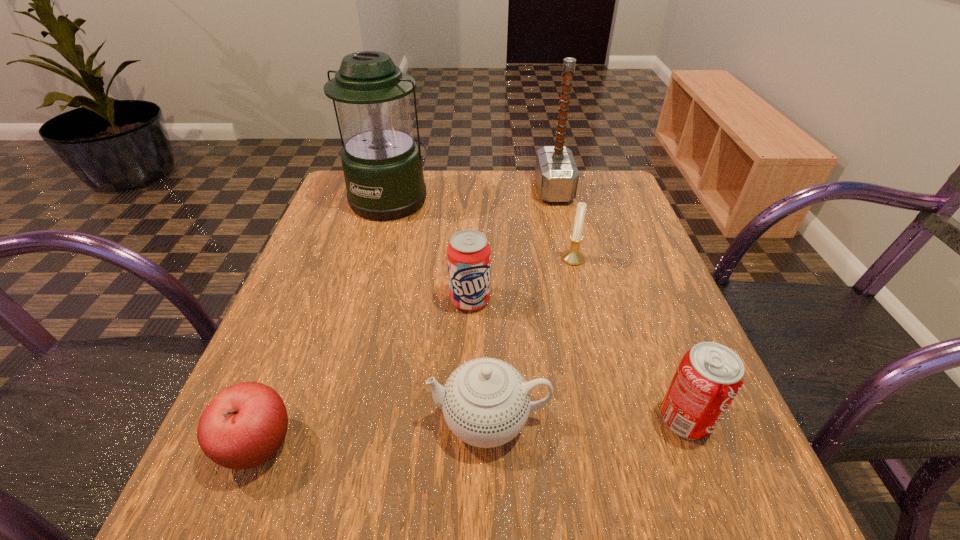
Identify the location of vacant space that satisfies the following two spatial constraints: 1. on the back side of the right soda can; 2. on the striking surface of the hammer. (598, 190).

Find the location of `free space that satisfies the following two spatial constraints: 1. on the spout of the chinaware; 2. on the front side of the apple`. free space that satisfies the following two spatial constraints: 1. on the spout of the chinaware; 2. on the front side of the apple is located at coordinates (x=490, y=446).

Image resolution: width=960 pixels, height=540 pixels. In order to click on vacant region that satisfies the following two spatial constraints: 1. on the striking surface of the hammer; 2. on the surface of the fourth nearest object in this screenshot , I will do click(x=580, y=300).

Where is `vacant space that satisfies the following two spatial constraints: 1. on the striking surface of the hammer; 2. on the back side of the candle holder`? vacant space that satisfies the following two spatial constraints: 1. on the striking surface of the hammer; 2. on the back side of the candle holder is located at coordinates (570, 259).